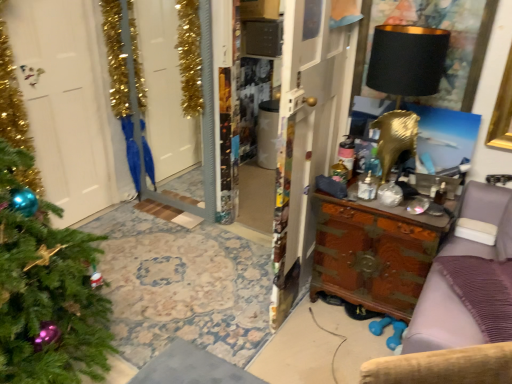
Image resolution: width=512 pixels, height=384 pixels. In order to click on empty space that is in between wooden chest at right and wooden chest at center in this screenshot , I will do `click(325, 327)`.